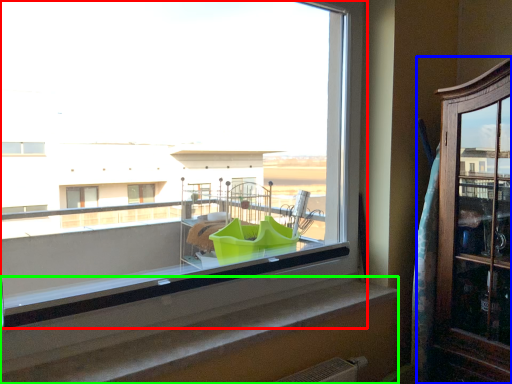
Question: Which object is the closest to the window (highlighted by a red box)? Choose among these: dresser (highlighted by a blue box) or window sill (highlighted by a green box).

Choices:
 (A) dresser
 (B) window sill

Answer: (A)